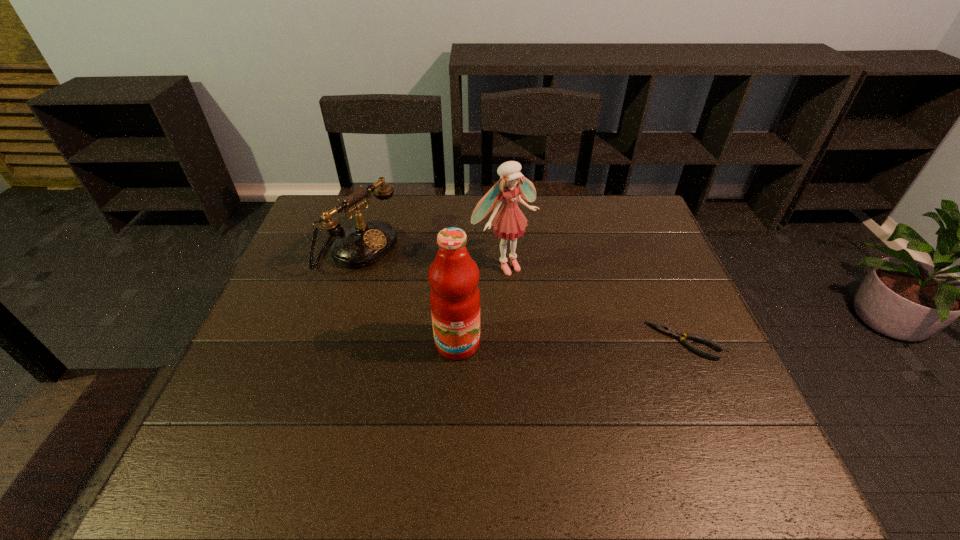
Locate an element on the screen. Image resolution: width=960 pixels, height=540 pixels. vacant point located 0.200m on the dial of the second shortest object is located at coordinates (441, 293).

Image resolution: width=960 pixels, height=540 pixels. I want to click on vacant space located 0.160m on the front-facing side of the doll, so click(560, 313).

The width and height of the screenshot is (960, 540). What are the coordinates of `vacant space located 0.170m on the front-facing side of the doll` in the screenshot? It's located at (563, 315).

In order to click on free space located on the front-facing side of the doll in this screenshot , I will do `click(560, 313)`.

Where is `object that is at the far edge`? object that is at the far edge is located at coordinates (364, 244).

Where is `object present at the left edge`? The image size is (960, 540). object present at the left edge is located at coordinates (364, 244).

Identify the location of object located at the right edge. (675, 334).

Locate an element on the screen. object situated at the far left corner is located at coordinates (364, 244).

This screenshot has height=540, width=960. Find the location of `free spot at the far edge of the desktop`. free spot at the far edge of the desktop is located at coordinates (494, 234).

At what (x,y) coordinates should I click in order to perform the action: click on vacant space at the near edge. Please return your answer as a coordinate pair (x, y). The height and width of the screenshot is (540, 960). Looking at the image, I should click on (651, 429).